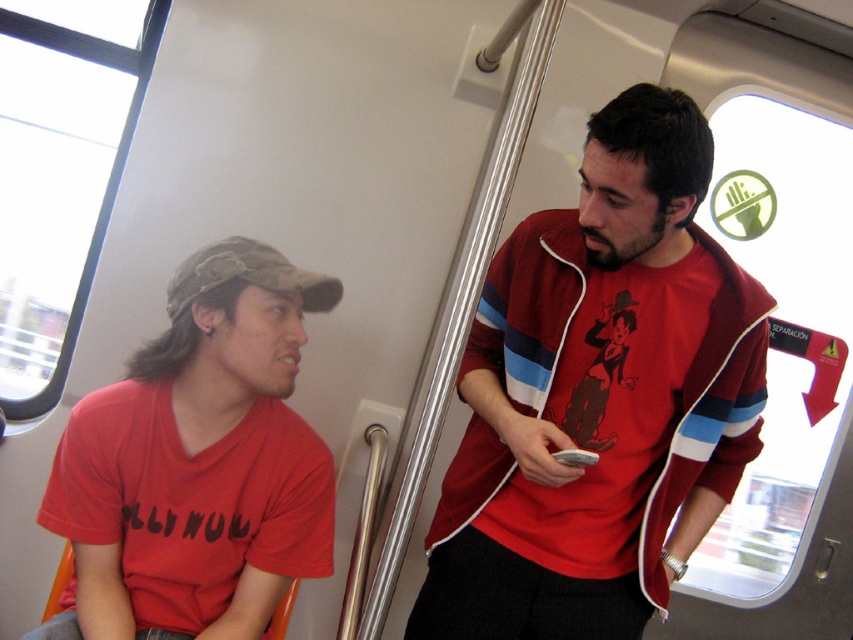
Question: Which point is closer to the camera taking this photo?

Choices:
 (A) (219, 266)
 (B) (235, 573)

Answer: (B)

Question: Can you confirm if matte red t-shirt at center is positioned below camouflage fabric baseball cap at left?

Choices:
 (A) yes
 (B) no

Answer: (A)

Question: Where is matte red t-shirt at center located in relation to matte red t-shirt at left in the image?

Choices:
 (A) above
 (B) below

Answer: (A)

Question: Which of these objects is positioned closest to the camouflage fabric baseball cap at left?

Choices:
 (A) matte red t-shirt at center
 (B) black matte earphone at left
 (C) matte red t-shirt at left

Answer: (C)

Question: Which point is closer to the camera?

Choices:
 (A) (x=257, y=275)
 (B) (x=206, y=332)
 (C) (x=589, y=317)

Answer: (C)

Question: Considering the relative positions of camouflage fabric baseball cap at left and black matte earphone at left in the image provided, where is camouflage fabric baseball cap at left located with respect to black matte earphone at left?

Choices:
 (A) below
 (B) above

Answer: (B)